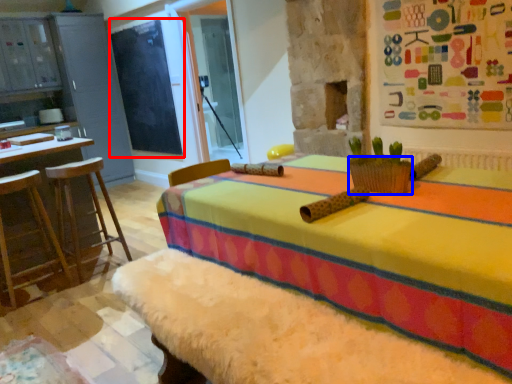
Question: Which of the following is the farthest to the observer, bulletin board (highlighted by a red box) or basket (highlighted by a blue box)?

Choices:
 (A) bulletin board
 (B) basket

Answer: (A)